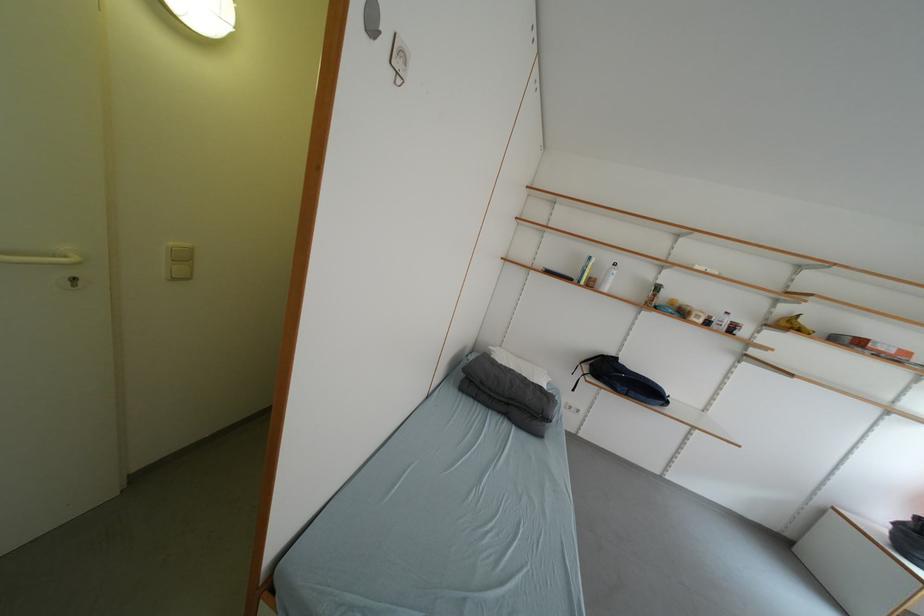
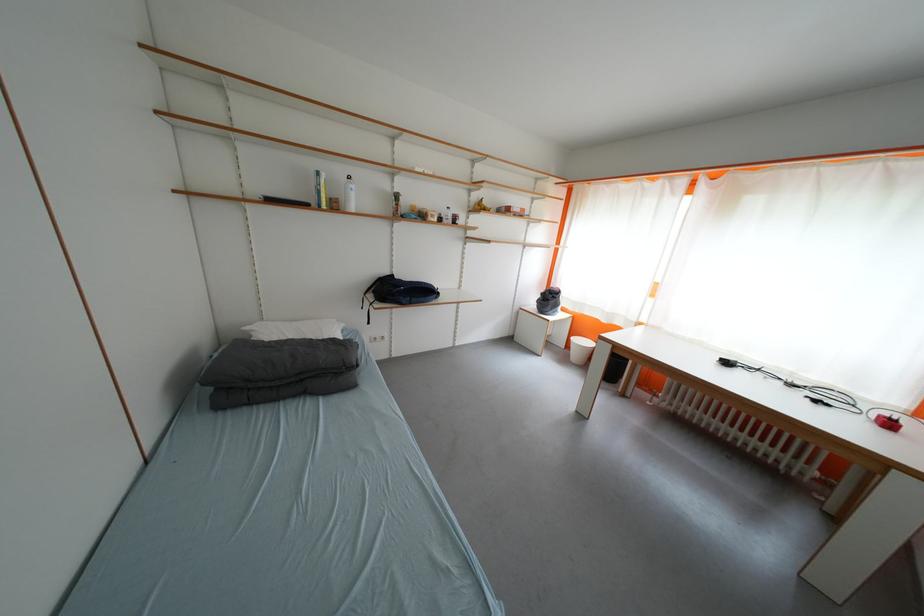
Locate, in the second image, the point that corresponds to the point at 761,341 in the first image.

(476, 225)